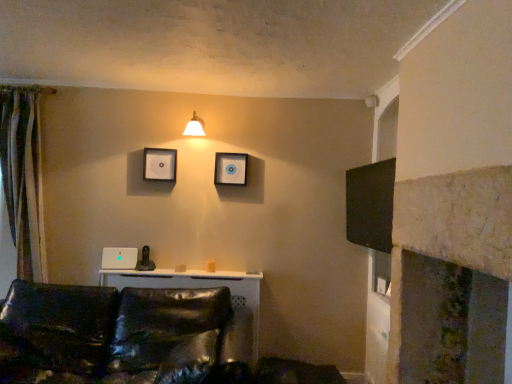
Question: Is the position of white glossy picture frame at upper center, arranged as the second picture frame when viewed from the left, more distant than that of shiny black leather couch at lower left?

Choices:
 (A) no
 (B) yes

Answer: (B)

Question: From the image's perspective, is white glossy picture frame at upper center, arranged as the second picture frame when viewed from the left, located beneath shiny black leather couch at lower left?

Choices:
 (A) yes
 (B) no

Answer: (B)

Question: Is white glossy picture frame at upper center, arranged as the second picture frame when viewed from the left, positioned in front of shiny black leather couch at lower left?

Choices:
 (A) no
 (B) yes

Answer: (A)

Question: Does white glossy picture frame at upper center, the first picture frame from the right, appear on the right side of shiny black leather couch at lower left?

Choices:
 (A) yes
 (B) no

Answer: (A)

Question: Is white glossy picture frame at upper center, the first picture frame from the right, far from shiny black leather couch at lower left?

Choices:
 (A) yes
 (B) no

Answer: (A)

Question: Considering their positions, is shiny black leather couch at lower left located in front of or behind white glossy picture frame at upper center, the first picture frame from the right?

Choices:
 (A) behind
 (B) front

Answer: (B)

Question: Is shiny black leather couch at lower left spatially inside white glossy picture frame at upper center, arranged as the second picture frame when viewed from the left, or outside of it?

Choices:
 (A) inside
 (B) outside

Answer: (B)

Question: Considering the positions of shiny black leather couch at lower left and white glossy picture frame at upper center, the first picture frame from the right, in the image, is shiny black leather couch at lower left wider or thinner than white glossy picture frame at upper center, the first picture frame from the right,?

Choices:
 (A) thin
 (B) wide

Answer: (B)

Question: Considering the relative positions of shiny black leather couch at lower left and white glossy picture frame at upper center, the first picture frame from the right, in the image provided, is shiny black leather couch at lower left to the left or to the right of white glossy picture frame at upper center, the first picture frame from the right,?

Choices:
 (A) right
 (B) left

Answer: (B)

Question: From a real-world perspective, is white glossy picture frame at upper center, the first picture frame from the right, physically located above or below white matte picture frame at upper center, the first picture frame from the left?

Choices:
 (A) above
 (B) below

Answer: (B)

Question: Considering their positions, is white glossy picture frame at upper center, the first picture frame from the right, located in front of or behind white matte picture frame at upper center, the first picture frame from the left?

Choices:
 (A) front
 (B) behind

Answer: (A)

Question: Is white glossy picture frame at upper center, arranged as the second picture frame when viewed from the left, taller or shorter than white matte picture frame at upper center, arranged as the second picture frame when viewed from the right?

Choices:
 (A) tall
 (B) short

Answer: (B)

Question: From the image's perspective, is white glossy picture frame at upper center, arranged as the second picture frame when viewed from the left, above or below white matte picture frame at upper center, arranged as the second picture frame when viewed from the right?

Choices:
 (A) below
 (B) above

Answer: (A)

Question: In the image, is white matte picture frame at upper center, the first picture frame from the left, on the left side or the right side of shiny black leather couch at lower left?

Choices:
 (A) right
 (B) left

Answer: (A)

Question: Looking at their shapes, would you say white matte picture frame at upper center, the first picture frame from the left, is wider or thinner than shiny black leather couch at lower left?

Choices:
 (A) thin
 (B) wide

Answer: (A)